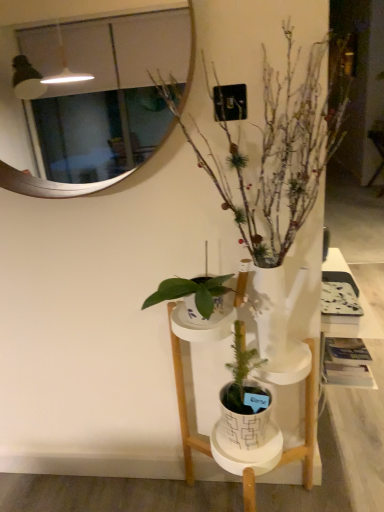
Image resolution: width=384 pixels, height=512 pixels. Find the location of `vacant location below white glossy mirror at upper center (from a real-world perspective)`. vacant location below white glossy mirror at upper center (from a real-world perspective) is located at coordinates [x=136, y=478].